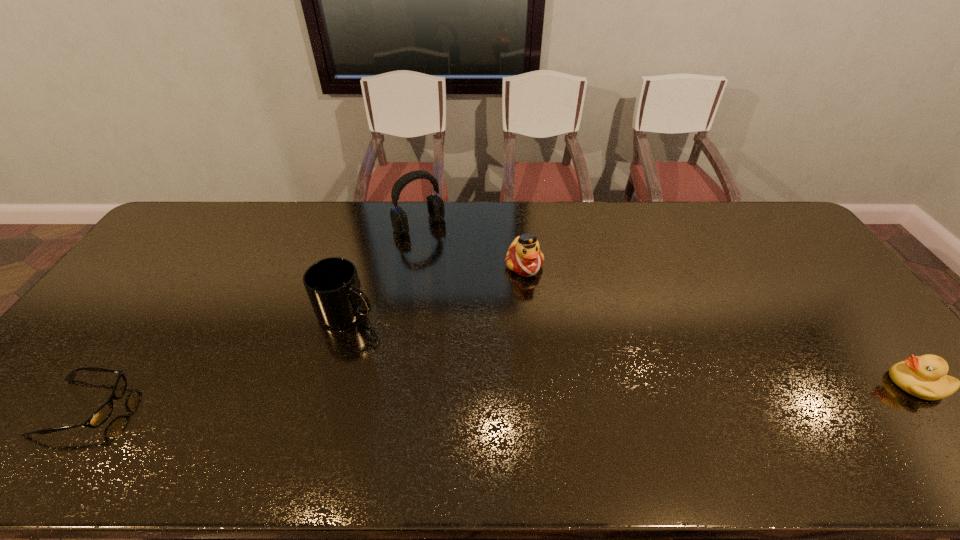
Find the location of a particular element. The height and width of the screenshot is (540, 960). vacant area at the near edge is located at coordinates (527, 404).

This screenshot has width=960, height=540. What are the coordinates of `vacant space at the left edge` in the screenshot? It's located at (176, 286).

In the image, there is a desktop. Identify the location of vacant space at the right edge. The image size is (960, 540). (835, 304).

The height and width of the screenshot is (540, 960). In the image, there is a desktop. Find the location of `vacant region at the far left corner`. vacant region at the far left corner is located at coordinates (180, 234).

This screenshot has height=540, width=960. I want to click on vacant space at the far right corner of the desktop, so click(x=775, y=235).

I want to click on vacant area between the mug and the fourth nearest object, so click(x=436, y=288).

Where is `free spot between the fourth tallest object and the shortest object`? The width and height of the screenshot is (960, 540). free spot between the fourth tallest object and the shortest object is located at coordinates (500, 396).

Locate an element on the screen. empty location between the tallest object and the third nearest object is located at coordinates (383, 268).

The width and height of the screenshot is (960, 540). In order to click on free space between the mug and the fourth nearest object in this screenshot , I will do `click(436, 288)`.

Identify the location of vacant area that lies between the second farthest object and the shortest object. The width and height of the screenshot is (960, 540). (304, 336).